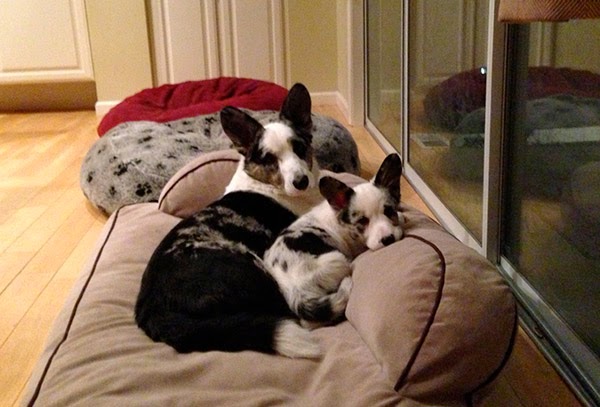
The width and height of the screenshot is (600, 407). Identify the location of wooden floor. (38, 242).